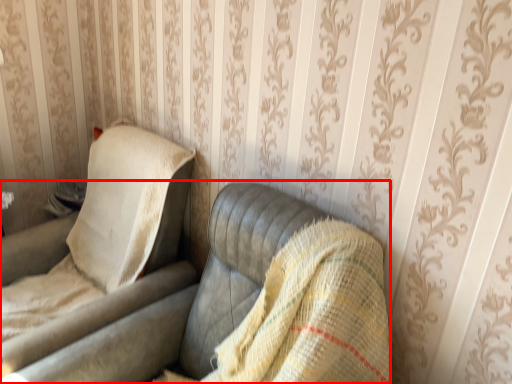
Question: From the image, what is the correct spatial relationship of studio couch (annotated by the red box) in relation to chair?

Choices:
 (A) right
 (B) left

Answer: (A)